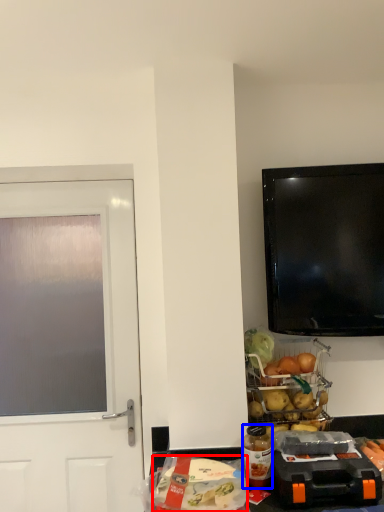
Question: Which object is further to the camera taking this photo, food (highlighted by a red box) or bottle (highlighted by a blue box)?

Choices:
 (A) food
 (B) bottle

Answer: (B)